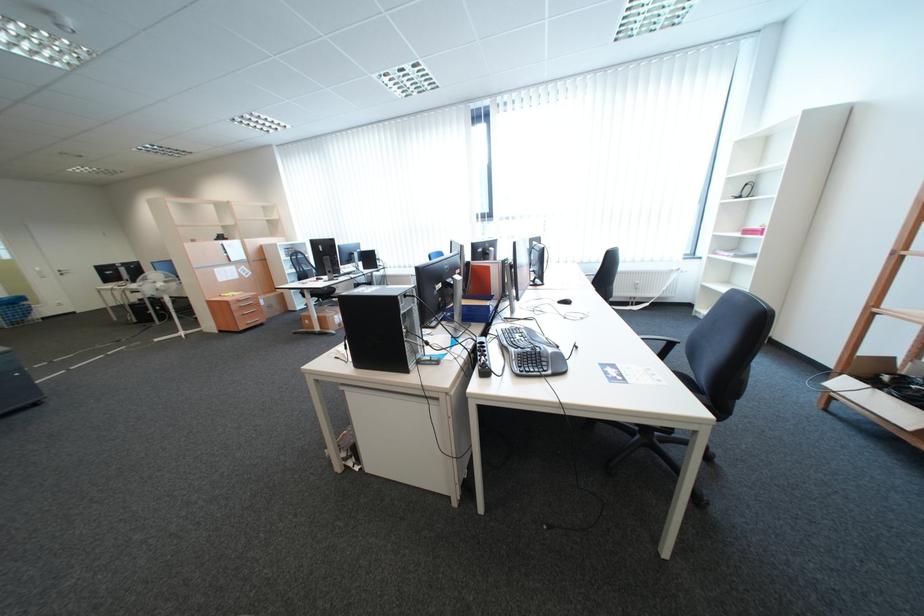
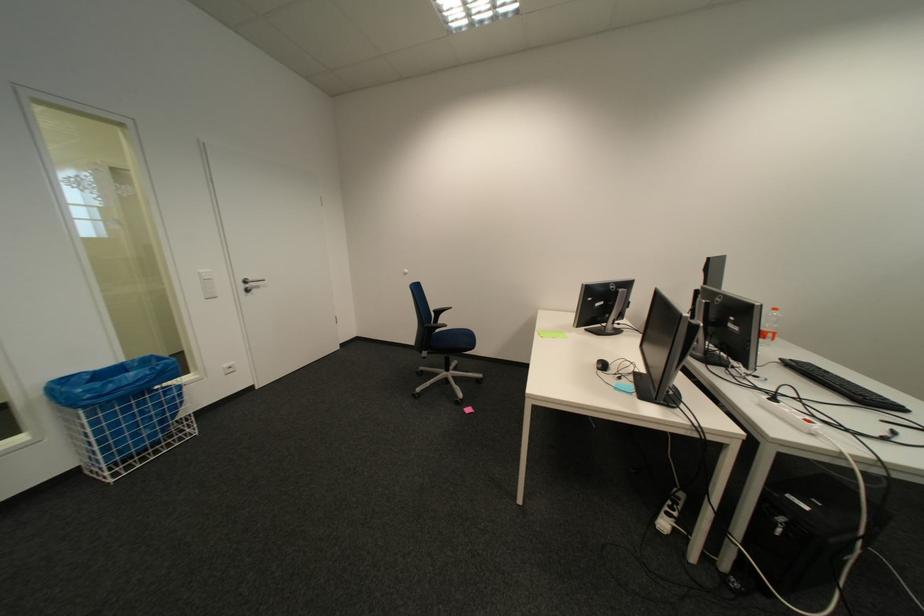
Find the pixel in the second image that matches (x=70, y=274) in the first image.

(254, 286)